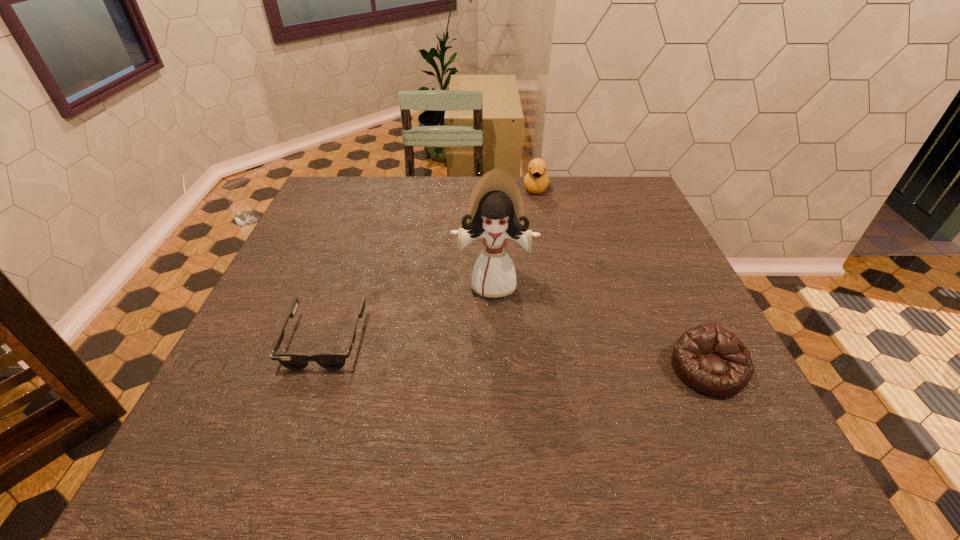
I want to click on vacant region located 0.220m facing forward on the second object from right to left, so click(533, 240).

Where is `free space located 0.120m facing forward on the second object from right to left`? Image resolution: width=960 pixels, height=540 pixels. free space located 0.120m facing forward on the second object from right to left is located at coordinates (534, 220).

This screenshot has width=960, height=540. I want to click on vacant space located 0.310m facing forward on the second object from right to left, so click(x=531, y=260).

I want to click on blank space located 0.290m at the front face of the second farthest object, so click(x=488, y=412).

Locate an element on the screen. The image size is (960, 540). blank space located 0.280m at the front face of the second farthest object is located at coordinates (488, 407).

The height and width of the screenshot is (540, 960). In order to click on vacant space located at the front face of the second farthest object in this screenshot , I will do `click(490, 352)`.

This screenshot has width=960, height=540. What are the coordinates of `object situated at the far edge` in the screenshot? It's located at (536, 180).

Image resolution: width=960 pixels, height=540 pixels. Find the location of `object that is positioned at the near edge`. object that is positioned at the near edge is located at coordinates (710, 359).

Image resolution: width=960 pixels, height=540 pixels. In order to click on object that is at the left edge in this screenshot , I will do `click(295, 361)`.

Where is `object that is at the right edge`? object that is at the right edge is located at coordinates [x=710, y=359].